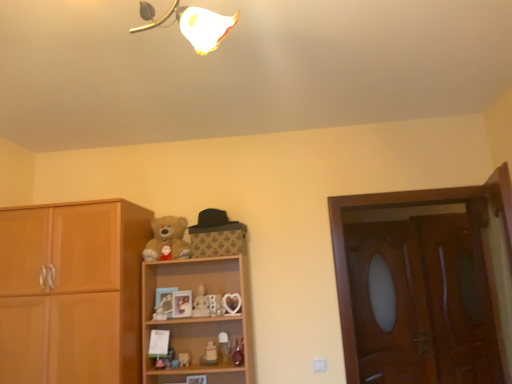
Question: From the image's perspective, is matte plastic cat at center, marked as the 4th toy in a right-to-left arrangement, located above wooden screen door at right, the 1th screen door positioned from the left?

Choices:
 (A) no
 (B) yes

Answer: (A)

Question: From the image's perspective, is matte plastic cat at center, positioned as the second toy in left-to-right order, located beneath wooden screen door at right, marked as the 2th screen door in a right-to-left arrangement?

Choices:
 (A) no
 (B) yes

Answer: (B)

Question: Are matte plastic cat at center, positioned as the second toy in left-to-right order, and wooden screen door at right, marked as the 2th screen door in a right-to-left arrangement, making contact?

Choices:
 (A) no
 (B) yes

Answer: (A)

Question: From a real-world perspective, is matte plastic cat at center, marked as the 4th toy in a right-to-left arrangement, located beneath wooden screen door at right, the 1th screen door positioned from the left?

Choices:
 (A) no
 (B) yes

Answer: (B)

Question: Is matte plastic cat at center, marked as the 4th toy in a right-to-left arrangement, turned away from wooden screen door at right, marked as the 2th screen door in a right-to-left arrangement?

Choices:
 (A) no
 (B) yes

Answer: (A)

Question: Based on their positions, is white porcelain figurine at center, the third toy positioned from the right, located to the left or right of matte plastic cat at center, marked as the 4th toy in a right-to-left arrangement?

Choices:
 (A) left
 (B) right

Answer: (B)

Question: From a real-world perspective, is white porcelain figurine at center, the third toy viewed from the left, physically located above or below matte plastic cat at center, marked as the 4th toy in a right-to-left arrangement?

Choices:
 (A) below
 (B) above

Answer: (B)

Question: Considering the positions of point (202, 306) and point (187, 352), is point (202, 306) closer or farther from the camera than point (187, 352)?

Choices:
 (A) closer
 (B) farther

Answer: (B)

Question: From their relative heights in the image, would you say white porcelain figurine at center, the third toy viewed from the left, is taller or shorter than matte plastic cat at center, positioned as the second toy in left-to-right order?

Choices:
 (A) tall
 (B) short

Answer: (A)

Question: Does point (467, 382) appear closer or farther from the camera than point (337, 233)?

Choices:
 (A) closer
 (B) farther

Answer: (B)

Question: In the image, is brown wooden screen door at right, the 1th screen door positioned from the right, positioned in front of or behind wooden door at right?

Choices:
 (A) behind
 (B) front

Answer: (A)

Question: In terms of size, does brown wooden screen door at right, the second screen door positioned from the left, appear bigger or smaller than wooden door at right?

Choices:
 (A) small
 (B) big

Answer: (A)

Question: From the image's perspective, is brown wooden screen door at right, the 1th screen door positioned from the right, located above or below wooden door at right?

Choices:
 (A) above
 (B) below

Answer: (B)

Question: In terms of size, does white glossy figurine at center, arranged as the fourth toy when viewed from the left, appear bigger or smaller than wooden door at right?

Choices:
 (A) big
 (B) small

Answer: (B)

Question: Considering the positions of point (215, 347) and point (483, 314), is point (215, 347) closer or farther from the camera than point (483, 314)?

Choices:
 (A) closer
 (B) farther

Answer: (A)